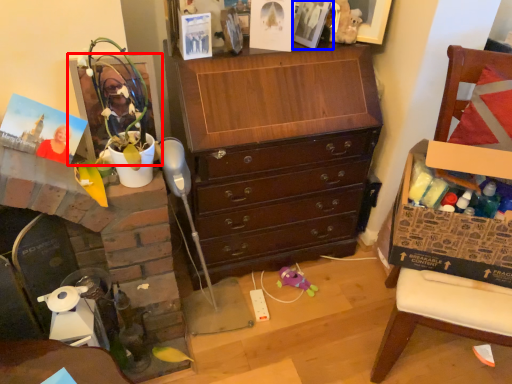
Question: Which of the following is the closest to the observer, picture frame (highlighted by a red box) or picture frame (highlighted by a blue box)?

Choices:
 (A) picture frame
 (B) picture frame

Answer: (A)